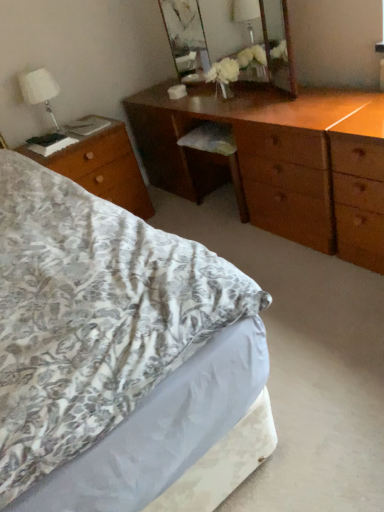
What is the approximate height of white fabric lampshade at upper left?

white fabric lampshade at upper left is 16.02 inches in height.

Describe the element at coordinates (39, 89) in the screenshot. I see `white fabric lampshade at upper left` at that location.

Describe the element at coordinates (112, 346) in the screenshot. The image size is (384, 512). I see `floral fabric bed at lower left` at that location.

Image resolution: width=384 pixels, height=512 pixels. In order to click on shiny brown dresser at center in this screenshot , I will do `click(280, 161)`.

At what (x,y) coordinates should I click in order to perform the action: click on wooden desk at left. Please return your answer as a coordinate pair (x, y). Looking at the image, I should click on (103, 168).

Measure the distance from wooden desk at left to wooden mirror at upper center.

They are 31.99 inches apart.

Find the location of a particular element. desk below the wooden mirror at upper center (from the image's perspective) is located at coordinates (103, 168).

Is wooden desk at left positioned with its back to wooden mirror at upper center?

No, wooden desk at left is not facing away from wooden mirror at upper center.

Considering the relative sizes of wooden desk at left and wooden mirror at upper center in the image provided, is wooden desk at left smaller than wooden mirror at upper center?

No, wooden desk at left is not smaller than wooden mirror at upper center.

Does floral fabric bed at lower left have a greater height compared to white fabric lampshade at upper left?

No.

Locate an element on the screen. Image resolution: width=384 pixels, height=512 pixels. bedside lamp located above the floral fabric bed at lower left (from the image's perspective) is located at coordinates (39, 89).

Can you confirm if floral fabric bed at lower left is thinner than white fabric lampshade at upper left?

No, floral fabric bed at lower left is not thinner than white fabric lampshade at upper left.

Considering the sizes of objects floral fabric bed at lower left and shiny brown dresser at center in the image provided, who is shorter, floral fabric bed at lower left or shiny brown dresser at center?

Standing shorter between the two is floral fabric bed at lower left.

How distant is floral fabric bed at lower left from shiny brown dresser at center?

floral fabric bed at lower left is 3.54 feet away from shiny brown dresser at center.

Is floral fabric bed at lower left situated inside shiny brown dresser at center or outside?

floral fabric bed at lower left is not enclosed by shiny brown dresser at center.

Looking at their sizes, would you say floral fabric bed at lower left is wider or thinner than shiny brown dresser at center?

Clearly, floral fabric bed at lower left has more width compared to shiny brown dresser at center.

In order to click on mirror on the right of the floral fabric bed at lower left in this screenshot , I will do `click(226, 50)`.

In terms of width, does floral fabric bed at lower left look wider or thinner when compared to wooden mirror at upper center?

Clearly, floral fabric bed at lower left has more width compared to wooden mirror at upper center.

Is wooden mirror at upper center at the back of floral fabric bed at lower left?

No, floral fabric bed at lower left is not facing away from wooden mirror at upper center.

Looking at the image, does floral fabric bed at lower left seem bigger or smaller compared to wooden mirror at upper center?

Clearly, floral fabric bed at lower left is larger in size than wooden mirror at upper center.

From the image's perspective, does shiny brown dresser at center appear higher than wooden desk at left?

Yes, from the image's perspective, shiny brown dresser at center is over wooden desk at left.

Can you tell me how much shiny brown dresser at center and wooden desk at left differ in facing direction?

The angle between the facing direction of shiny brown dresser at center and the facing direction of wooden desk at left is 90.5 degrees.

Between shiny brown dresser at center and wooden desk at left, which one appears on the left side from the viewer's perspective?

wooden desk at left.

From the image's perspective, which one is positioned higher, white fabric lampshade at upper left or shiny brown dresser at center?

white fabric lampshade at upper left is shown above in the image.

From a real-world perspective, which object rests below the other?

shiny brown dresser at center, from a real-world perspective.

Is point (52, 89) less distant than point (219, 116)?

No, (52, 89) is further to viewer.

Is white fabric lampshade at upper left positioned in front of shiny brown dresser at center?

No, it is not.

Considering the sizes of wooden mirror at upper center and floral fabric bed at lower left in the image, is wooden mirror at upper center wider or thinner than floral fabric bed at lower left?

Clearly, wooden mirror at upper center has less width compared to floral fabric bed at lower left.

From the image's perspective, between wooden mirror at upper center and floral fabric bed at lower left, which one is located above?

wooden mirror at upper center.

Where is `bed that is on the left side of wooden mirror at upper center`? bed that is on the left side of wooden mirror at upper center is located at coordinates (112, 346).

You are a GUI agent. You are given a task and a screenshot of the screen. Output one action in this format:
    pyautogui.click(x=<x>, y=<y>)
    Task: Click on the desk below the wooden mirror at upper center (from a real-world perspective)
    This screenshot has height=512, width=384.
    Given the screenshot: What is the action you would take?
    pyautogui.click(x=103, y=168)

The height and width of the screenshot is (512, 384). I want to click on bedside lamp lying on the left of floral fabric bed at lower left, so click(39, 89).

From the image, which object appears to be nearer to wooden desk at left, floral fabric bed at lower left or shiny brown dresser at center?

shiny brown dresser at center is positioned closer to the anchor wooden desk at left.

Which object lies further to the anchor point wooden desk at left, white fabric lampshade at upper left or wooden mirror at upper center?

wooden mirror at upper center.

Looking at the image, which one is located further to wooden mirror at upper center, shiny brown dresser at center or white fabric lampshade at upper left?

white fabric lampshade at upper left is positioned further to the anchor wooden mirror at upper center.

Estimate the real-world distances between objects in this image. Which object is further from white fabric lampshade at upper left, wooden desk at left or floral fabric bed at lower left?

floral fabric bed at lower left lies further to white fabric lampshade at upper left than the other object.

Considering their positions, is wooden desk at left positioned further to wooden mirror at upper center than white fabric lampshade at upper left?

Based on the image, white fabric lampshade at upper left appears to be further to wooden mirror at upper center.

Which object lies further to the anchor point wooden desk at left, shiny brown dresser at center or floral fabric bed at lower left?

The object further to wooden desk at left is floral fabric bed at lower left.

Considering their positions, is wooden mirror at upper center positioned further to shiny brown dresser at center than floral fabric bed at lower left?

floral fabric bed at lower left.

Considering their positions, is shiny brown dresser at center positioned further to floral fabric bed at lower left than wooden desk at left?

shiny brown dresser at center is positioned further to the anchor floral fabric bed at lower left.

You are a GUI agent. You are given a task and a screenshot of the screen. Output one action in this format:
    pyautogui.click(x=<x>, y=<y>)
    Task: Click on the desk between white fabric lampshade at upper left and wooden mirror at upper center
    The height and width of the screenshot is (512, 384).
    Given the screenshot: What is the action you would take?
    pyautogui.click(x=103, y=168)

This screenshot has height=512, width=384. What are the coordinates of `chest of drawers between floral fabric bed at lower left and wooden desk at left along the z-axis` in the screenshot? It's located at (280, 161).

Locate an element on the screen. Image resolution: width=384 pixels, height=512 pixels. desk between white fabric lampshade at upper left and shiny brown dresser at center in the horizontal direction is located at coordinates (103, 168).

What are the coordinates of `bedside lamp between wooden mirror at upper center and floral fabric bed at lower left in the vertical direction` in the screenshot? It's located at point(39,89).